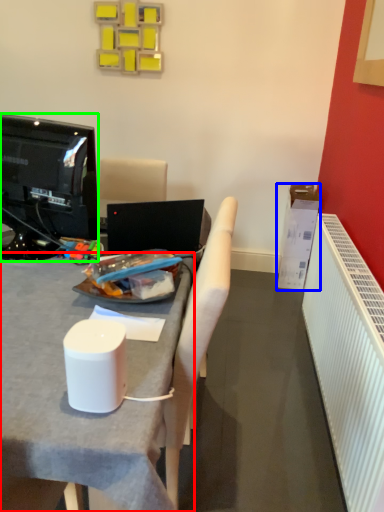
Question: Which object is the farthest from desk (highlighted by a red box)? Choose among these: box (highlighted by a blue box) or television (highlighted by a green box).

Choices:
 (A) box
 (B) television

Answer: (A)